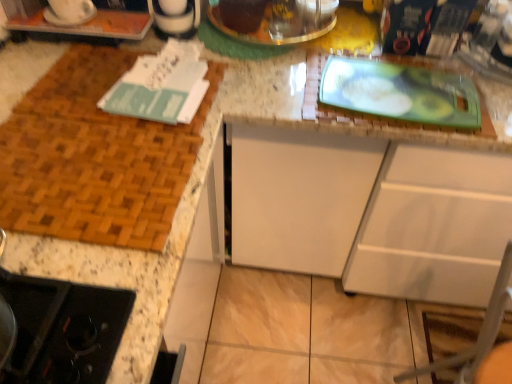
You are a GUI agent. You are given a task and a screenshot of the screen. Output one action in this format:
    pyautogui.click(x=<x>, y=<y>)
    Task: Click on the blank space above white matte cabinet at center (from a real-world perspective)
    Image resolution: width=512 pixels, height=384 pixels.
    Given the screenshot: What is the action you would take?
    pyautogui.click(x=399, y=76)